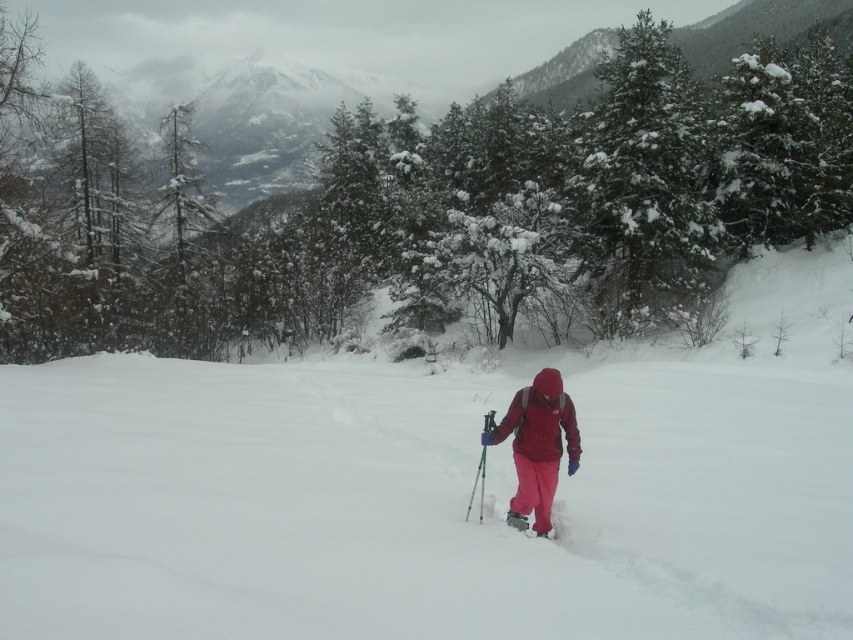
Question: Does pink matte ski at center appear under teal metallic ski pole at center?

Choices:
 (A) yes
 (B) no

Answer: (A)

Question: In this image, where is white snow ski slope at center located relative to pink matte ski at center?

Choices:
 (A) above
 (B) below

Answer: (A)

Question: Considering the relative positions of snow-covered evergreen tree at center and snow-covered evergreen at upper right in the image provided, where is snow-covered evergreen tree at center located with respect to snow-covered evergreen at upper right?

Choices:
 (A) right
 (B) left

Answer: (B)

Question: Which point is farther from the camera taking this photo?

Choices:
 (A) (641, 228)
 (B) (560, 518)

Answer: (A)

Question: Which object appears farthest from the camera in this image?

Choices:
 (A) matte red jacket at center
 (B) pink matte ski at center

Answer: (B)

Question: Which of the following is the closest to the observer?

Choices:
 (A) (665, 172)
 (B) (572, 424)
 (C) (491, 412)

Answer: (C)